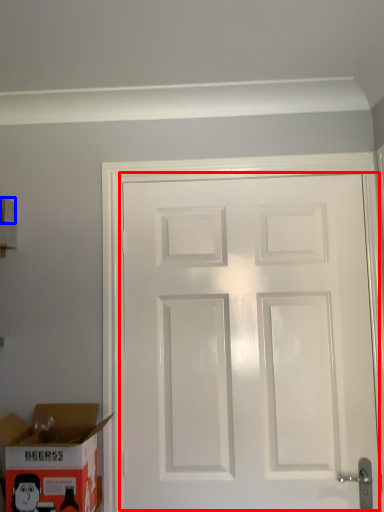
Question: Which object is further to the camera taking this photo, door (highlighted by a red box) or box (highlighted by a blue box)?

Choices:
 (A) door
 (B) box

Answer: (B)